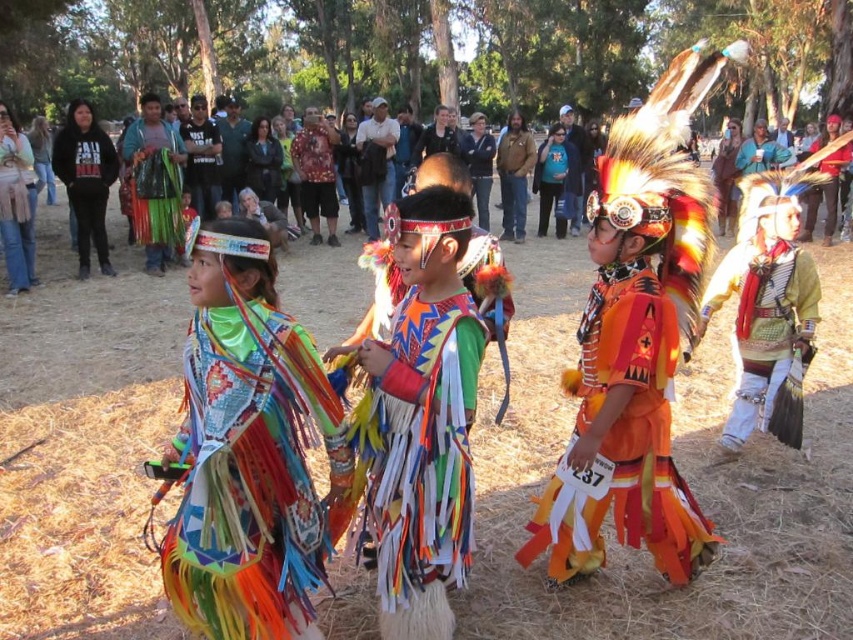
Question: Does black hoodie at left appear over multicolored fabric skirt at upper left?

Choices:
 (A) yes
 (B) no

Answer: (B)

Question: Which object is closer to the camera taking this photo?

Choices:
 (A) multicolored fringed vest at center
 (B) orange fabric headdress at center
 (C) multicolored feathers at center
 (D) multicolored fabric skirt at upper left

Answer: (A)

Question: Which of the following is the farthest from the observer?

Choices:
 (A) (68, 204)
 (B) (68, 275)

Answer: (A)

Question: Is orange fabric headdress at center to the right of multicolored feathers at center from the viewer's perspective?

Choices:
 (A) yes
 (B) no

Answer: (A)

Question: Does orange fabric headdress at center have a larger size compared to black hoodie at left?

Choices:
 (A) no
 (B) yes

Answer: (A)

Question: Based on their relative distances, which object is farther from the multicolored fabric skirt at upper left?

Choices:
 (A) yellow-green fabric headdress at right
 (B) multicolored feathers at center
 (C) orange fabric headdress at center
 (D) multicolored fringed dress at center

Answer: (C)